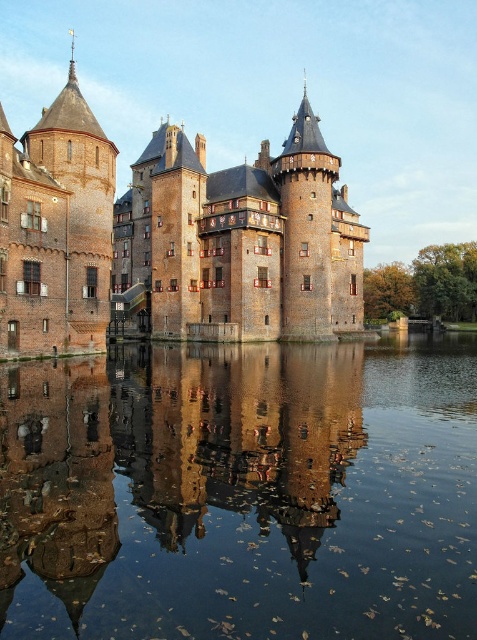
You are an architect analyzing the castle layout. Based on the scene, which structure is shorter between the brick stone castle at center and the brick tower at left?

The brick stone castle at center is shorter than the brick tower at left.

You are standing in front of the castle and want to take a photo that includes the point at coordinates point (x=163, y=214). If your camera has a maximum focus range of 100 meters, will you be able to focus on that point?

The distance of point (x=163, y=214) from viewer is 92.18 meters, which is within the camera maximum focus range of 100 meters. Therefore, you can focus on that point.

You are a tourist standing at the edge of the smooth reflective water at center, looking towards the brick stone castle at center. Which object appears taller from your perspective?

The brick stone castle at center appears taller than the smooth reflective water at center because the smooth reflective water at center has a lesser height compared to the brick stone castle at center.